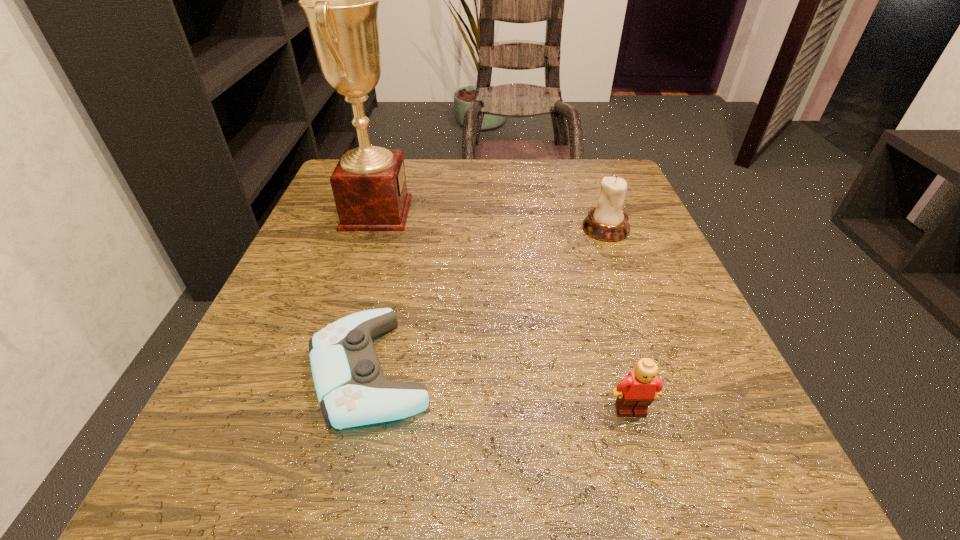
The image size is (960, 540). What are the coordinates of `control at the left edge` in the screenshot? It's located at (351, 388).

Identify the location of candle holder that is at the right edge. The width and height of the screenshot is (960, 540). (607, 222).

Find the location of a particular element. Lego that is at the right edge is located at coordinates (636, 392).

Identify the location of object at the far left corner. (340, 0).

You are a GUI agent. You are given a task and a screenshot of the screen. Output one action in this format:
    pyautogui.click(x=<x>, y=<y>)
    Task: Click on the vacant space at the far edge
    
    Given the screenshot: What is the action you would take?
    pyautogui.click(x=444, y=165)

In the image, there is a desktop. Where is `blank space at the near edge`? blank space at the near edge is located at coordinates (416, 443).

Find the location of a particular element. vacant space at the left edge of the desktop is located at coordinates (304, 265).

The image size is (960, 540). In the image, there is a desktop. In order to click on vacant space at the right edge in this screenshot , I will do `click(610, 312)`.

Where is `vacant region at the far right corner`? vacant region at the far right corner is located at coordinates (619, 168).

You are a GUI agent. You are given a task and a screenshot of the screen. Output one action in this format:
    pyautogui.click(x=<x>, y=<y>)
    Task: Click on the free space between the control and the trophy cup
    The image size is (960, 540).
    Given the screenshot: What is the action you would take?
    pyautogui.click(x=373, y=292)